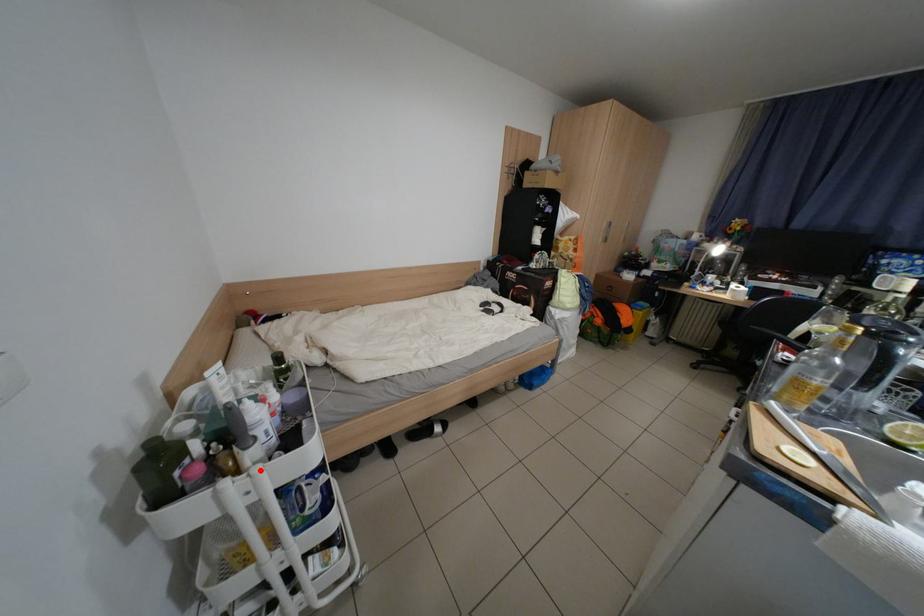
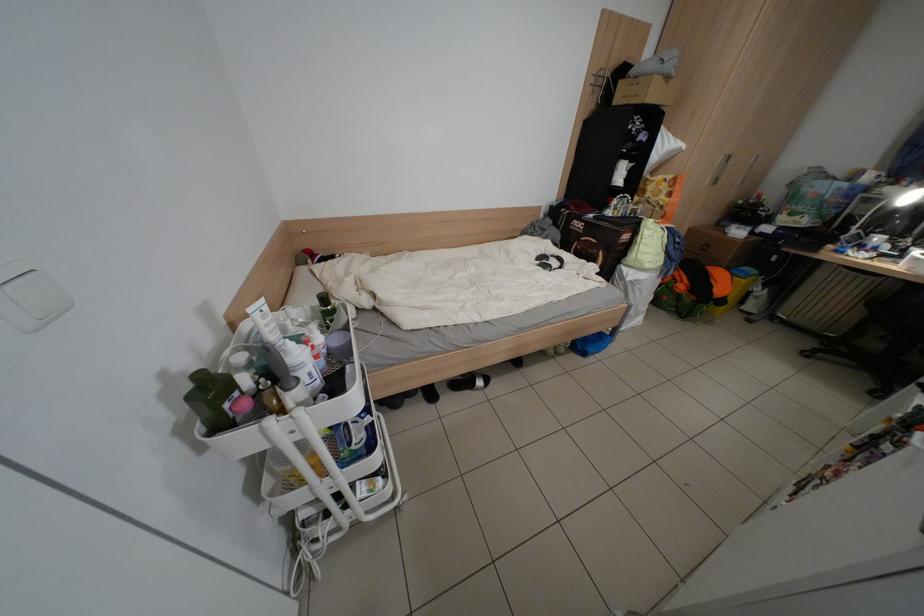
Locate, in the second image, the point that corresponds to the highlighted location in the first image.

(304, 411)